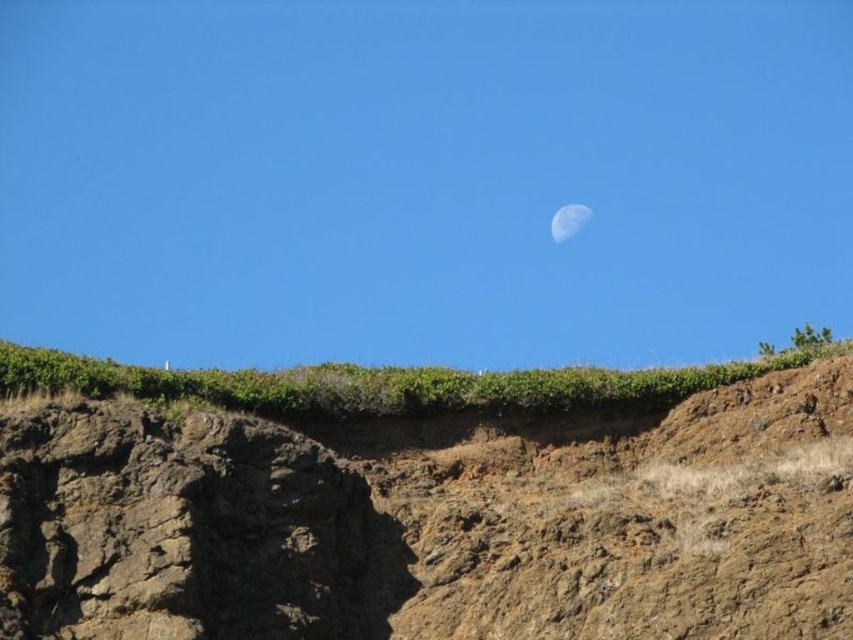
Question: Which point is closer to the camera?

Choices:
 (A) satin white moon at upper center
 (B) brown rocky cliff at upper center

Answer: (B)

Question: Can you confirm if brown rocky cliff at upper center is positioned below satin white moon at upper center?

Choices:
 (A) no
 (B) yes

Answer: (B)

Question: Does brown rocky cliff at upper center have a smaller size compared to satin white moon at upper center?

Choices:
 (A) no
 (B) yes

Answer: (A)

Question: Does brown rocky cliff at upper center have a larger size compared to satin white moon at upper center?

Choices:
 (A) yes
 (B) no

Answer: (A)

Question: Which point appears closest to the camera in this image?

Choices:
 (A) (563, 214)
 (B) (248, 412)

Answer: (B)